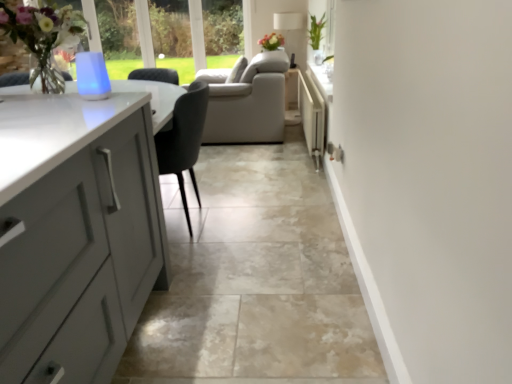
Question: Is white plastic radiator at center-right inside the boundaries of matte gray cabinets at left, or outside?

Choices:
 (A) outside
 (B) inside

Answer: (A)

Question: Based on their positions, is white plastic radiator at center-right located to the left or right of matte gray cabinets at left?

Choices:
 (A) left
 (B) right

Answer: (B)

Question: Which object is positioned farthest from the matte gray cabinets at left?

Choices:
 (A) matte floral arrangement at center
 (B) green leafy plant at upper right
 (C) white plastic radiator at center-right
 (D) white glossy lampshade at upper center

Answer: (D)

Question: Which object is the closest to the green leafy plant at upper right?

Choices:
 (A) matte floral arrangement at center
 (B) white glossy lampshade at upper center
 (C) matte gray cabinets at left
 (D) white plastic radiator at center-right

Answer: (A)